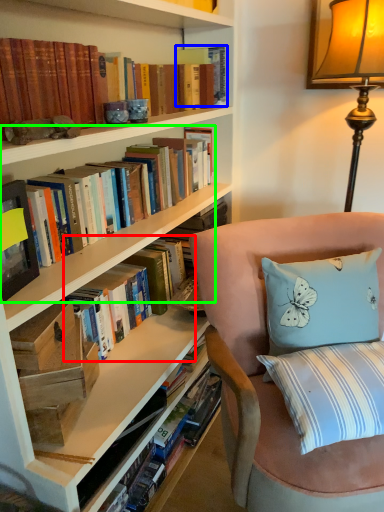
Question: Based on their relative distances, which object is farther from book (highlighted by a red box)? Choose from paperback book (highlighted by a blue box) and book (highlighted by a green box).

Choices:
 (A) paperback book
 (B) book

Answer: (A)